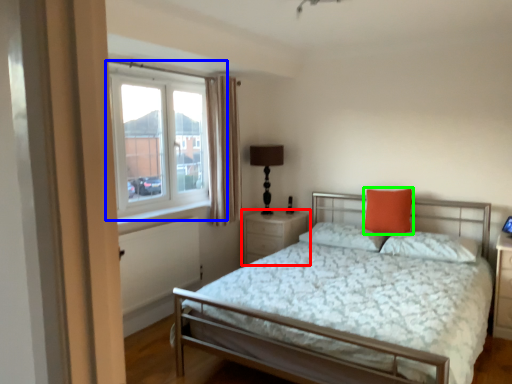
Question: Which is farther away from nightstand (highlighted by a red box)? window (highlighted by a blue box) or pillow (highlighted by a green box)?

Choices:
 (A) window
 (B) pillow

Answer: (A)